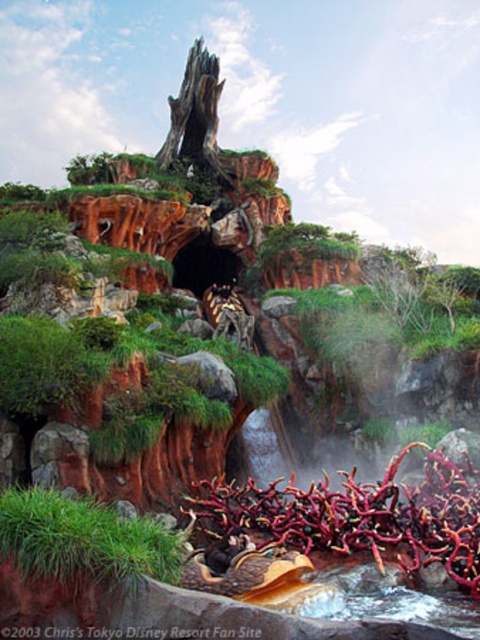
Based on the photo, you are a traveler in this fantastical landscape and need to cross from the green grassy patch at lower left to the rubberized red vines at lower center. Given that the red vines are larger, which path would you take to ensure stability?

The rubberized red vines at lower center are larger in size than the green grassy patch at lower left, so stepping onto the rubberized red vines at lower center would provide a more stable path for crossing.

You are a character in a video game who needs to jump from the rubberized red vines at lower center to the green grassy patch at lower left. Given that your character can jump a maximum distance of 13 meters, will you be able to make the jump?

The rubberized red vines at lower center and green grassy patch at lower left are 13.24 meters apart, so the character cannot make the jump as it exceeds their maximum jump distance of 13 meters.

You are standing at the base of the rock formation in the image and want to reach the point marked at coordinates (272, 525). Given that your maximum comfortable walking distance is 200 feet, can you comfortably walk to that point without needing to rest?

The point at coordinates (272, 525) is 188.30 feet away from the viewer, which is within your maximum comfortable walking distance of 200 feet. Therefore, you can comfortably walk to that point without needing to rest.